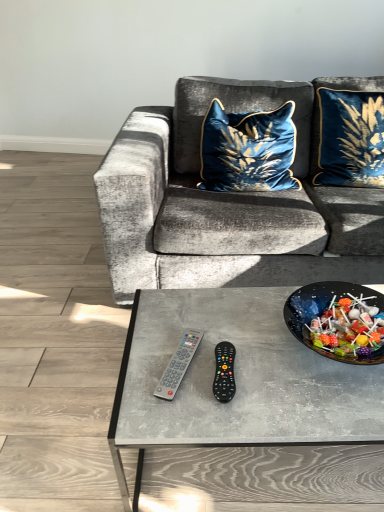
Locate an element on the screen. The width and height of the screenshot is (384, 512). velvet blue cushion at center, placed as the second pillow when sorted from right to left is located at coordinates (248, 150).

The width and height of the screenshot is (384, 512). I want to click on black plastic remote at center, so click(x=224, y=372).

Consider the image. Is the depth of gray plastic remote at center greater than that of velvet blue pillow at upper right, positioned as the second pillow in left-to-right order?

No, it is not.

From the picture: Can you confirm if gray plastic remote at center is taller than velvet blue pillow at upper right, positioned as the second pillow in left-to-right order?

No, gray plastic remote at center is not taller than velvet blue pillow at upper right, positioned as the second pillow in left-to-right order.

Is point (189, 336) more distant than point (367, 112)?

No, it is not.

From a real-world perspective, is gray plastic remote at center positioned over velvet blue pillow at upper right, positioned as the second pillow in left-to-right order, based on gravity?

Actually, gray plastic remote at center is physically below velvet blue pillow at upper right, positioned as the second pillow in left-to-right order, in the real world.

In the scene shown: Can you tell me how much velvet blue cushion at center, which is counted as the 1th pillow, starting from the left, and shiny black bowl at center differ in facing direction?

There is a 10.6-degree angle between the facing directions of velvet blue cushion at center, which is counted as the 1th pillow, starting from the left, and shiny black bowl at center.

Is velvet blue cushion at center, which is counted as the 1th pillow, starting from the left, in contact with shiny black bowl at center?

No.

Considering the sizes of velvet blue cushion at center, placed as the second pillow when sorted from right to left, and shiny black bowl at center in the image, is velvet blue cushion at center, placed as the second pillow when sorted from right to left, taller or shorter than shiny black bowl at center?

Considering their sizes, velvet blue cushion at center, placed as the second pillow when sorted from right to left, has more height than shiny black bowl at center.

Between velvet blue cushion at center, which is counted as the 1th pillow, starting from the left, and shiny black bowl at center, which one has smaller width?

Answer: shiny black bowl at center is thinner.

Is velvet blue pillow at upper right, marked as the 1th pillow in a right-to-left arrangement, behind velvet blue cushion at center, placed as the second pillow when sorted from right to left?

No, velvet blue pillow at upper right, marked as the 1th pillow in a right-to-left arrangement, is closer to the camera.

From the image's perspective, is velvet blue pillow at upper right, positioned as the second pillow in left-to-right order, located above velvet blue cushion at center, placed as the second pillow when sorted from right to left?

Yes, from the image's perspective, velvet blue pillow at upper right, positioned as the second pillow in left-to-right order, is above velvet blue cushion at center, placed as the second pillow when sorted from right to left.

Which object is wider, velvet blue pillow at upper right, positioned as the second pillow in left-to-right order, or velvet blue cushion at center, which is counted as the 1th pillow, starting from the left?

Wider between the two is velvet blue cushion at center, which is counted as the 1th pillow, starting from the left.

Considering the sizes of objects velvet blue pillow at upper right, positioned as the second pillow in left-to-right order, and velvet blue cushion at center, placed as the second pillow when sorted from right to left, in the image provided, who is taller, velvet blue pillow at upper right, positioned as the second pillow in left-to-right order, or velvet blue cushion at center, placed as the second pillow when sorted from right to left,?

Standing taller between the two is velvet blue pillow at upper right, positioned as the second pillow in left-to-right order.

What are the coordinates of `bowl located underneath the velvet blue pillow at upper right, positioned as the second pillow in left-to-right order (from a real-world perspective)` in the screenshot? It's located at (338, 321).

From a real-world perspective, which is physically above, velvet blue pillow at upper right, marked as the 1th pillow in a right-to-left arrangement, or shiny black bowl at center?

velvet blue pillow at upper right, marked as the 1th pillow in a right-to-left arrangement, from a real-world perspective.

Which of these two, velvet blue pillow at upper right, marked as the 1th pillow in a right-to-left arrangement, or shiny black bowl at center, is thinner?

Thinner between the two is velvet blue pillow at upper right, marked as the 1th pillow in a right-to-left arrangement.

Is velvet blue pillow at upper right, marked as the 1th pillow in a right-to-left arrangement, turned away from shiny black bowl at center?

No, velvet blue pillow at upper right, marked as the 1th pillow in a right-to-left arrangement, is not facing the opposite direction of shiny black bowl at center.

How far apart are velvet blue cushion at center, which is counted as the 1th pillow, starting from the left, and gray plastic remote at center?

velvet blue cushion at center, which is counted as the 1th pillow, starting from the left, and gray plastic remote at center are 3.53 feet apart.

Consider the image. Is velvet blue cushion at center, which is counted as the 1th pillow, starting from the left, completely or partially outside of gray plastic remote at center?

Yes, velvet blue cushion at center, which is counted as the 1th pillow, starting from the left, is outside of gray plastic remote at center.

From the image's perspective, relative to gray plastic remote at center, is velvet blue cushion at center, placed as the second pillow when sorted from right to left, above or below?

Clearly, from the image's perspective, velvet blue cushion at center, placed as the second pillow when sorted from right to left, is above gray plastic remote at center.

Does velvet blue cushion at center, which is counted as the 1th pillow, starting from the left, appear on the left side of velvet blue pillow at upper right, marked as the 1th pillow in a right-to-left arrangement?

Correct, you'll find velvet blue cushion at center, which is counted as the 1th pillow, starting from the left, to the left of velvet blue pillow at upper right, marked as the 1th pillow in a right-to-left arrangement.

From the image's perspective, which object appears higher, velvet blue cushion at center, placed as the second pillow when sorted from right to left, or velvet blue pillow at upper right, marked as the 1th pillow in a right-to-left arrangement?

velvet blue pillow at upper right, marked as the 1th pillow in a right-to-left arrangement, is shown above in the image.

Are velvet blue cushion at center, which is counted as the 1th pillow, starting from the left, and velvet blue pillow at upper right, marked as the 1th pillow in a right-to-left arrangement, located far from each other?

That's not correct — velvet blue cushion at center, which is counted as the 1th pillow, starting from the left, is a little close to velvet blue pillow at upper right, marked as the 1th pillow in a right-to-left arrangement.

Is velvet blue cushion at center, placed as the second pillow when sorted from right to left, aimed at velvet blue pillow at upper right, positioned as the second pillow in left-to-right order?

No, velvet blue cushion at center, placed as the second pillow when sorted from right to left, does not turn towards velvet blue pillow at upper right, positioned as the second pillow in left-to-right order.

Between point (220, 389) and point (380, 319), which one is positioned behind?

Positioned behind is point (380, 319).

Is black plastic remote at center outside of shiny black bowl at center?

Yes, black plastic remote at center is outside of shiny black bowl at center.

Is black plastic remote at center oriented away from shiny black bowl at center?

No, shiny black bowl at center is not at the back of black plastic remote at center.

From the gray plastic remote at center, count 2nd pillow to the right and point to it. Please provide its 2D coordinates.

[(350, 138)]

You are a GUI agent. You are given a task and a screenshot of the screen. Output one action in this format:
    pyautogui.click(x=<x>, y=<y>)
    Task: Click on the bowl in front of the velvet blue cushion at center, placed as the second pillow when sorted from right to left
    The height and width of the screenshot is (512, 384).
    Given the screenshot: What is the action you would take?
    pyautogui.click(x=338, y=321)

Based on their spatial positions, is shiny black bowl at center or velvet blue cushion at center, which is counted as the 1th pillow, starting from the left, further from black plastic remote at center?

velvet blue cushion at center, which is counted as the 1th pillow, starting from the left.

In the scene shown: Looking at the image, which one is located closer to gray plastic remote at center, velvet blue pillow at upper right, positioned as the second pillow in left-to-right order, or shiny black bowl at center?

Based on the image, shiny black bowl at center appears to be nearer to gray plastic remote at center.

Estimate the real-world distances between objects in this image. Which object is further from velvet blue pillow at upper right, positioned as the second pillow in left-to-right order, velvet blue cushion at center, placed as the second pillow when sorted from right to left, or gray plastic remote at center?

gray plastic remote at center lies further to velvet blue pillow at upper right, positioned as the second pillow in left-to-right order, than the other object.

Estimate the real-world distances between objects in this image. Which object is closer to gray plastic remote at center, shiny black bowl at center or velvet blue cushion at center, placed as the second pillow when sorted from right to left?

shiny black bowl at center lies closer to gray plastic remote at center than the other object.

Estimate the real-world distances between objects in this image. Which object is closer to black plastic remote at center, gray plastic remote at center or velvet blue cushion at center, placed as the second pillow when sorted from right to left?

gray plastic remote at center is closer to black plastic remote at center.

Looking at the image, which one is located closer to shiny black bowl at center, velvet blue pillow at upper right, positioned as the second pillow in left-to-right order, or black plastic remote at center?

black plastic remote at center is positioned closer to the anchor shiny black bowl at center.

Which object lies further to the anchor point velvet blue cushion at center, which is counted as the 1th pillow, starting from the left, gray plastic remote at center or black plastic remote at center?

black plastic remote at center lies further to velvet blue cushion at center, which is counted as the 1th pillow, starting from the left, than the other object.

From the image, which object appears to be farther from gray plastic remote at center, velvet blue pillow at upper right, positioned as the second pillow in left-to-right order, or black plastic remote at center?

velvet blue pillow at upper right, positioned as the second pillow in left-to-right order.

Identify the location of remote control between velvet blue cushion at center, which is counted as the 1th pillow, starting from the left, and black plastic remote at center vertically. Image resolution: width=384 pixels, height=512 pixels. (178, 365).

Where is `bowl that lies between velvet blue cushion at center, placed as the second pillow when sorted from right to left, and black plastic remote at center from top to bottom`? This screenshot has height=512, width=384. bowl that lies between velvet blue cushion at center, placed as the second pillow when sorted from right to left, and black plastic remote at center from top to bottom is located at coordinates (338, 321).

You are a GUI agent. You are given a task and a screenshot of the screen. Output one action in this format:
    pyautogui.click(x=<x>, y=<y>)
    Task: Click on the remote control that lies between velvet blue pillow at upper right, marked as the 1th pillow in a right-to-left arrangement, and black plastic remote at center from top to bottom
    This screenshot has width=384, height=512.
    Given the screenshot: What is the action you would take?
    pyautogui.click(x=178, y=365)

In order to click on pillow between velvet blue pillow at upper right, marked as the 1th pillow in a right-to-left arrangement, and black plastic remote at center vertically in this screenshot , I will do `click(248, 150)`.